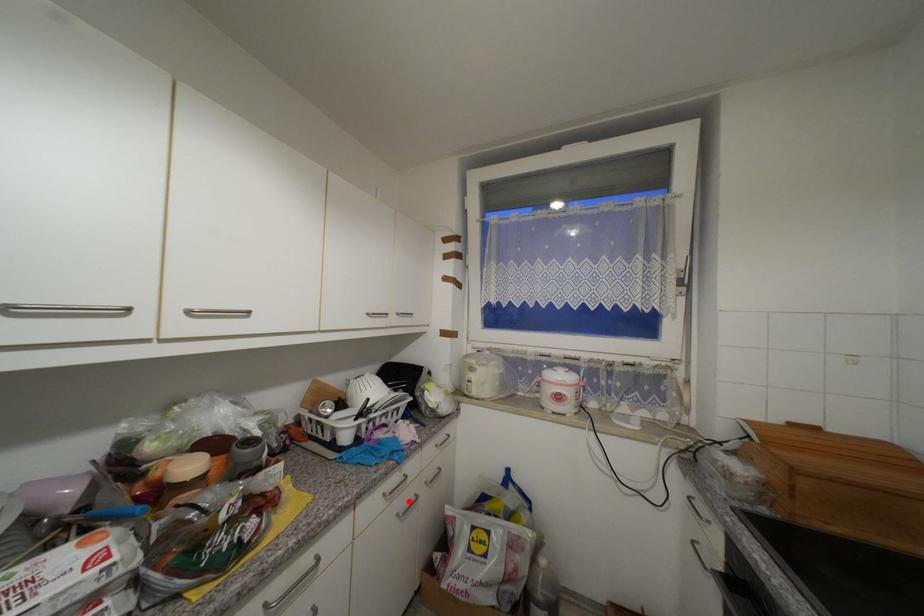
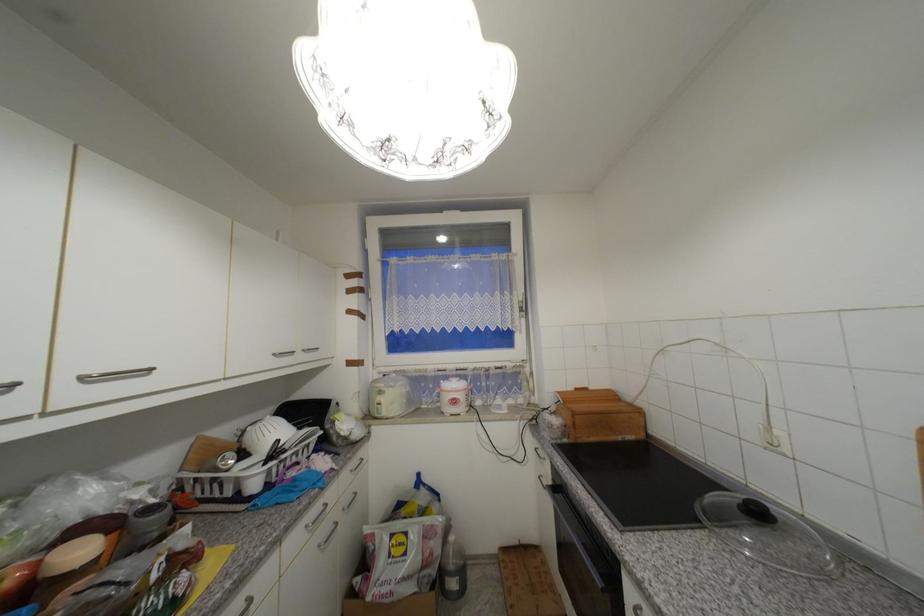
Locate, in the second image, the point that corresponds to the highlighted location in the first image.

(330, 531)